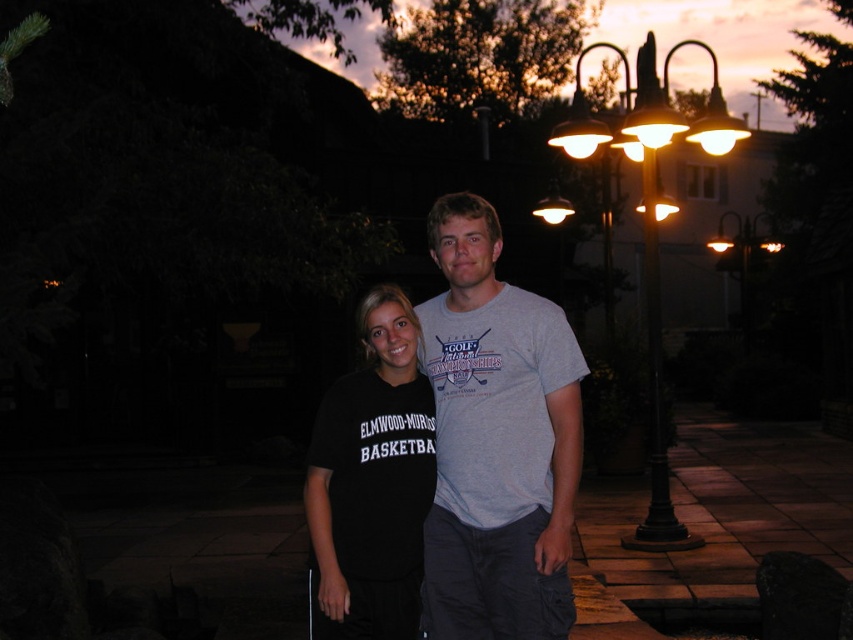
Identify the location of gray cotton t-shirt at center. This screenshot has width=853, height=640. (496, 440).

Does point (450, 241) come in front of point (393, 420)?

Yes, point (450, 241) is in front of point (393, 420).

Locate an element on the screen. The height and width of the screenshot is (640, 853). gray cotton t-shirt at center is located at coordinates (496, 440).

This screenshot has width=853, height=640. What do you see at coordinates (372, 481) in the screenshot? I see `black matte t-shirt at center` at bounding box center [372, 481].

Where is `black matte t-shirt at center`? The image size is (853, 640). black matte t-shirt at center is located at coordinates (372, 481).

Does gray cotton t-shirt at center have a greater height compared to metallic streetlamp at right?

In fact, gray cotton t-shirt at center may be shorter than metallic streetlamp at right.

Between gray cotton t-shirt at center and metallic streetlamp at right, which one has less height?

gray cotton t-shirt at center is shorter.

The width and height of the screenshot is (853, 640). Identify the location of gray cotton t-shirt at center. (496, 440).

You are a GUI agent. You are given a task and a screenshot of the screen. Output one action in this format:
    pyautogui.click(x=<x>, y=<y>)
    Task: Click on the gray cotton t-shirt at center
    This screenshot has width=853, height=640.
    Given the screenshot: What is the action you would take?
    pyautogui.click(x=496, y=440)